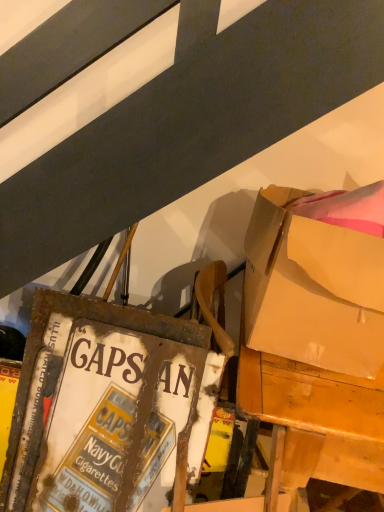
Question: Is wooden desk at right at the left side of matte cardboard box at upper right?

Choices:
 (A) no
 (B) yes

Answer: (A)

Question: Is wooden desk at right oriented away from matte cardboard box at upper right?

Choices:
 (A) no
 (B) yes

Answer: (A)

Question: From the image's perspective, is wooden desk at right below matte cardboard box at upper right?

Choices:
 (A) no
 (B) yes

Answer: (B)

Question: Is wooden desk at right oriented towards matte cardboard box at upper right?

Choices:
 (A) yes
 (B) no

Answer: (B)

Question: Can you see wooden desk at right touching matte cardboard box at upper right?

Choices:
 (A) yes
 (B) no

Answer: (B)

Question: From a real-world perspective, is rusty metal signboard at lower left positioned above or below matte cardboard box at upper right?

Choices:
 (A) below
 (B) above

Answer: (A)

Question: Is rusty metal signboard at lower left bigger or smaller than matte cardboard box at upper right?

Choices:
 (A) big
 (B) small

Answer: (A)

Question: Would you say rusty metal signboard at lower left is inside or outside matte cardboard box at upper right?

Choices:
 (A) inside
 (B) outside

Answer: (B)

Question: Is point (43, 340) closer or farther from the camera than point (322, 266)?

Choices:
 (A) closer
 (B) farther

Answer: (B)

Question: Would you say rusty metal signboard at lower left is inside or outside wooden desk at right?

Choices:
 (A) outside
 (B) inside

Answer: (A)

Question: Based on their sizes in the image, would you say rusty metal signboard at lower left is bigger or smaller than wooden desk at right?

Choices:
 (A) big
 (B) small

Answer: (B)

Question: In terms of height, does rusty metal signboard at lower left look taller or shorter compared to wooden desk at right?

Choices:
 (A) short
 (B) tall

Answer: (B)

Question: Is point (147, 367) positioned closer to the camera than point (244, 410)?

Choices:
 (A) farther
 (B) closer

Answer: (A)

Question: Is matte cardboard box at upper right bigger or smaller than rusty metal signboard at lower left?

Choices:
 (A) small
 (B) big

Answer: (A)

Question: From a real-world perspective, is matte cardboard box at upper right physically located above or below rusty metal signboard at lower left?

Choices:
 (A) below
 (B) above

Answer: (B)